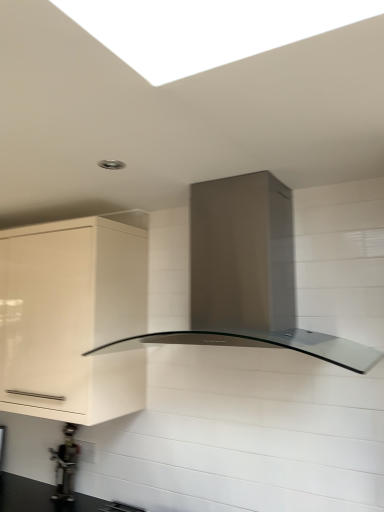
Question: Is satin metallic range hood at center taller than white glossy cabinet at left?

Choices:
 (A) yes
 (B) no

Answer: (B)

Question: Is satin metallic range hood at center not within white glossy cabinet at left?

Choices:
 (A) yes
 (B) no

Answer: (A)

Question: Does satin metallic range hood at center appear on the left side of white glossy cabinet at left?

Choices:
 (A) no
 (B) yes

Answer: (A)

Question: Is white glossy cabinet at left at the back of satin metallic range hood at center?

Choices:
 (A) yes
 (B) no

Answer: (B)

Question: From the image's perspective, is satin metallic range hood at center located above white glossy cabinet at left?

Choices:
 (A) no
 (B) yes

Answer: (B)

Question: Is metallic gray water heater at lower left bigger or smaller than satin metallic range hood at center?

Choices:
 (A) big
 (B) small

Answer: (B)

Question: From their relative heights in the image, would you say metallic gray water heater at lower left is taller or shorter than satin metallic range hood at center?

Choices:
 (A) short
 (B) tall

Answer: (A)

Question: In terms of width, does metallic gray water heater at lower left look wider or thinner when compared to satin metallic range hood at center?

Choices:
 (A) wide
 (B) thin

Answer: (B)

Question: Considering their positions, is metallic gray water heater at lower left located in front of or behind satin metallic range hood at center?

Choices:
 (A) behind
 (B) front

Answer: (A)

Question: Relative to metallic gray water heater at lower left, is white glossy cabinet at left in front or behind?

Choices:
 (A) front
 (B) behind

Answer: (A)

Question: Is white glossy cabinet at left taller or shorter than metallic gray water heater at lower left?

Choices:
 (A) short
 (B) tall

Answer: (B)

Question: From the image's perspective, relative to metallic gray water heater at lower left, is white glossy cabinet at left above or below?

Choices:
 (A) above
 (B) below

Answer: (A)

Question: From a real-world perspective, relative to metallic gray water heater at lower left, is white glossy cabinet at left vertically above or below?

Choices:
 (A) above
 (B) below

Answer: (A)

Question: Based on their sizes in the image, would you say satin metallic range hood at center is bigger or smaller than white glossy cabinet at left?

Choices:
 (A) big
 (B) small

Answer: (B)

Question: Is satin metallic range hood at center spatially inside white glossy cabinet at left, or outside of it?

Choices:
 (A) inside
 (B) outside

Answer: (B)